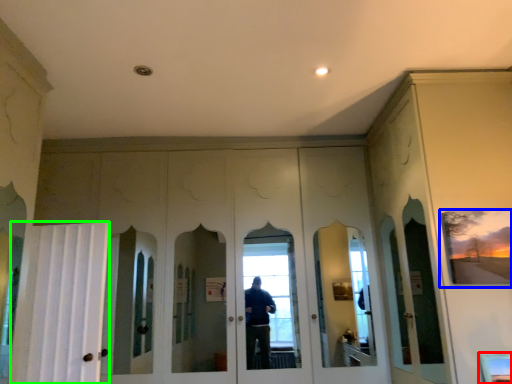
Question: Estimate the real-world distances between objects in this image. Which object is farther from window (highlighted by a red box), picture frame (highlighted by a blue box) or curtain (highlighted by a green box)?

Choices:
 (A) picture frame
 (B) curtain

Answer: (B)